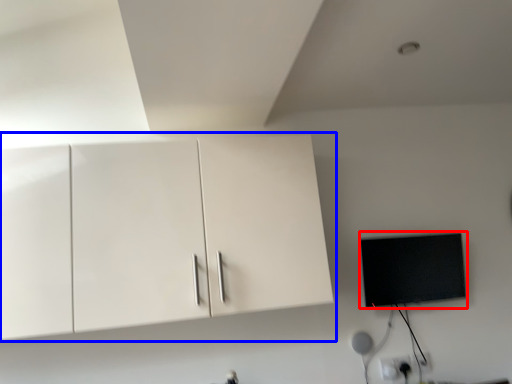
Question: Which of the following is the farthest to the observer, flat (highlighted by a red box) or cabinetry (highlighted by a blue box)?

Choices:
 (A) flat
 (B) cabinetry

Answer: (A)